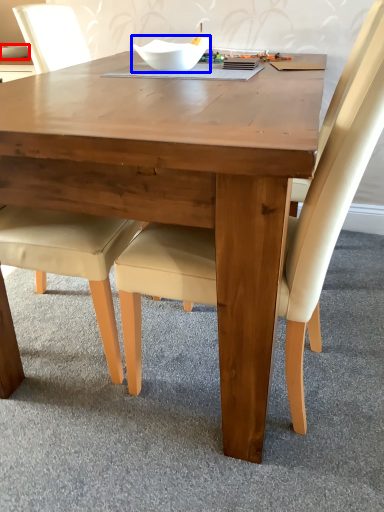
Question: Which object is closer to the camera taking this photo, glass bowl (highlighted by a red box) or bowl (highlighted by a blue box)?

Choices:
 (A) glass bowl
 (B) bowl

Answer: (B)